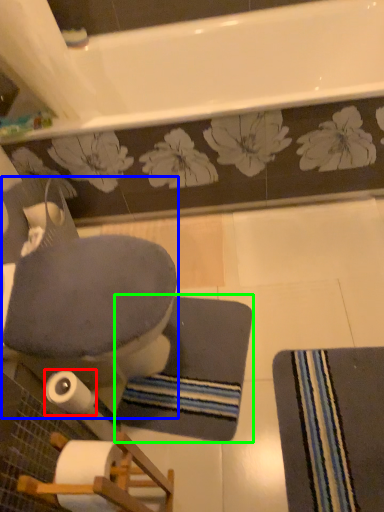
Question: Estimate the real-world distances between objects in this image. Which object is closer to toilet paper (highlighted by a red box), rocking chair (highlighted by a blue box) or bath mat (highlighted by a green box)?

Choices:
 (A) rocking chair
 (B) bath mat

Answer: (A)